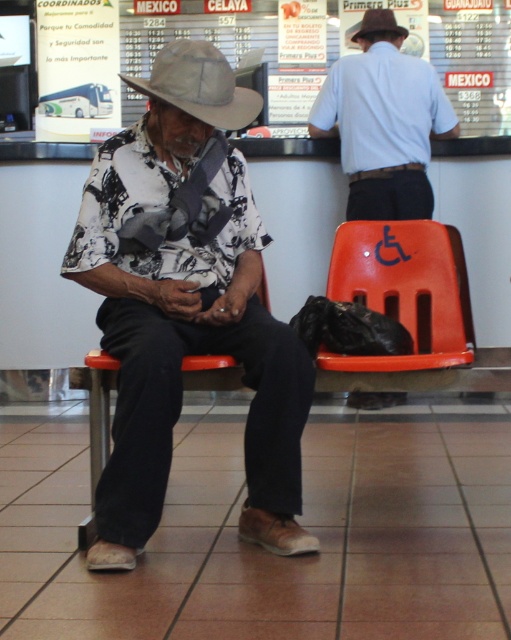
Which is more to the left, printed cotton shirt at center or orange plastic chair at center?

Positioned to the left is orange plastic chair at center.

Which of these two, printed cotton shirt at center or orange plastic chair at center, stands taller?

printed cotton shirt at center is taller.

Is point (260, 330) behind point (151, 282)?

No.

Locate an element on the screen. printed cotton shirt at center is located at coordinates (x=185, y=305).

Between light blue shirt at center and brown felt fedora at upper center, which one is positioned lower?

light blue shirt at center

Can you confirm if light blue shirt at center is thinner than brown felt fedora at upper center?

No.

Which is in front, point (370, 129) or point (376, 29)?

Point (370, 129)

Locate an element on the screen. The width and height of the screenshot is (511, 640). light blue shirt at center is located at coordinates (383, 122).

Which is above, printed cotton shirt at center or orange plastic chair at right?

Positioned higher is printed cotton shirt at center.

Locate an element on the screen. The height and width of the screenshot is (640, 511). printed cotton shirt at center is located at coordinates (185, 305).

Where is `printed cotton shirt at center`? printed cotton shirt at center is located at coordinates (185, 305).